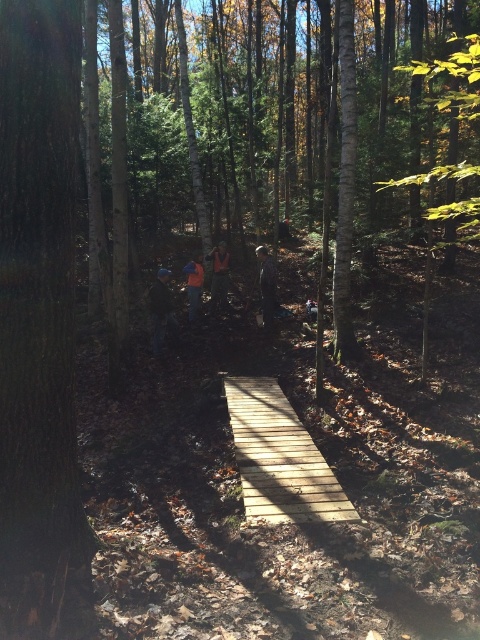
Question: Based on their relative distances, which object is farther from the orange fabric jacket at center?

Choices:
 (A) dark blue fabric jacket at center
 (B) light brown wooden bridge at center
 (C) brown rough bark at left

Answer: (C)

Question: Which object is positioned closest to the orange fabric jacket at center?

Choices:
 (A) camouflage jacket at center
 (B) dark blue fabric jacket at center

Answer: (B)

Question: Does camouflage jacket at center appear on the left side of orange fabric at center?

Choices:
 (A) no
 (B) yes

Answer: (A)

Question: Is orange fabric at center bigger than orange fabric jacket at center?

Choices:
 (A) yes
 (B) no

Answer: (A)

Question: Which point is closer to the camera?

Choices:
 (A) camouflage jacket at center
 (B) dark blue fabric jacket at center
 (C) brown rough bark at left
 (D) orange fabric at center

Answer: (C)

Question: Is orange fabric at center in front of orange fabric jacket at center?

Choices:
 (A) no
 (B) yes

Answer: (A)